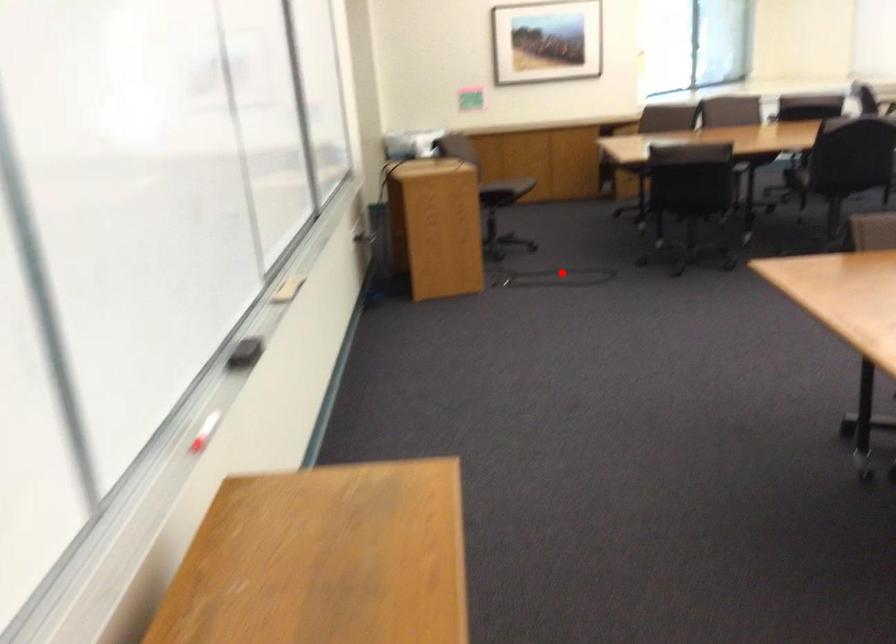
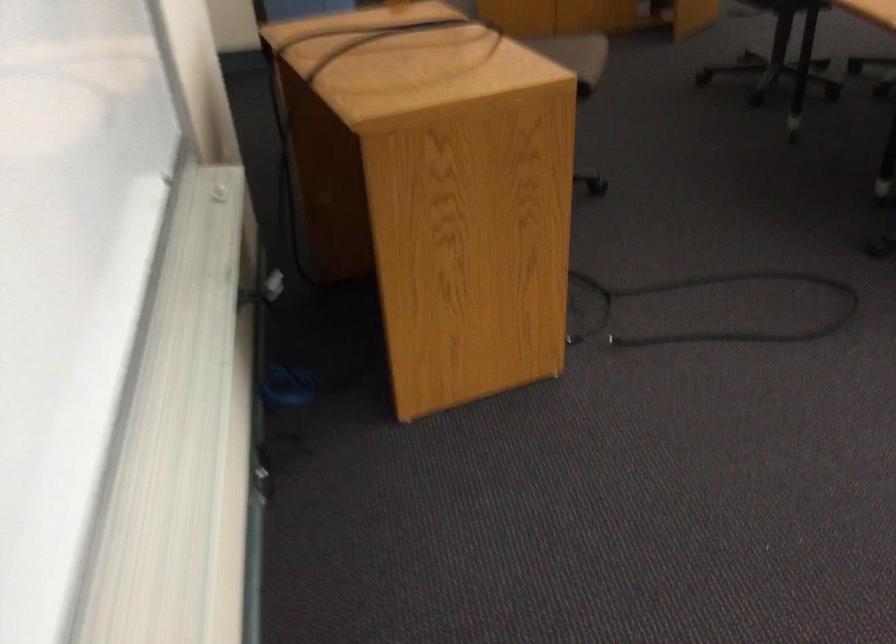
In the second image, find the point that corresponds to the highlighted location in the first image.

(712, 308)